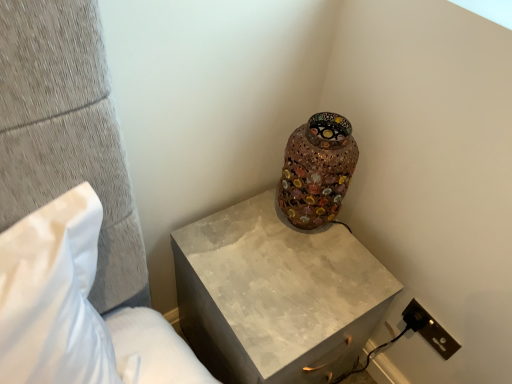
Question: Can you confirm if brown plastic electrical outlet at lower right is wider than mosaic glass vase at upper right?

Choices:
 (A) no
 (B) yes

Answer: (A)

Question: Is brown plastic electrical outlet at lower right looking in the opposite direction of mosaic glass vase at upper right?

Choices:
 (A) no
 (B) yes

Answer: (A)

Question: Could you tell me if brown plastic electrical outlet at lower right is facing mosaic glass vase at upper right?

Choices:
 (A) no
 (B) yes

Answer: (A)

Question: Is brown plastic electrical outlet at lower right closer to camera compared to mosaic glass vase at upper right?

Choices:
 (A) yes
 (B) no

Answer: (B)

Question: Considering the relative sizes of brown plastic electrical outlet at lower right and mosaic glass vase at upper right in the image provided, is brown plastic electrical outlet at lower right thinner than mosaic glass vase at upper right?

Choices:
 (A) no
 (B) yes

Answer: (B)

Question: Considering their positions, is brown plastic electrical outlet at lower right located in front of or behind matte concrete nightstand at upper right?

Choices:
 (A) behind
 (B) front

Answer: (A)

Question: Would you say brown plastic electrical outlet at lower right is inside or outside matte concrete nightstand at upper right?

Choices:
 (A) inside
 (B) outside

Answer: (B)

Question: In terms of width, does brown plastic electrical outlet at lower right look wider or thinner when compared to matte concrete nightstand at upper right?

Choices:
 (A) wide
 (B) thin

Answer: (B)

Question: Is point (413, 309) positioned closer to the camera than point (177, 246)?

Choices:
 (A) closer
 (B) farther

Answer: (B)

Question: From a real-world perspective, is mosaic glass vase at upper right above or below matte concrete nightstand at upper right?

Choices:
 (A) below
 (B) above

Answer: (B)

Question: Visually, is mosaic glass vase at upper right positioned to the left or to the right of matte concrete nightstand at upper right?

Choices:
 (A) left
 (B) right

Answer: (B)

Question: Considering the positions of mosaic glass vase at upper right and matte concrete nightstand at upper right in the image, is mosaic glass vase at upper right taller or shorter than matte concrete nightstand at upper right?

Choices:
 (A) short
 (B) tall

Answer: (A)

Question: Considering the positions of point (329, 188) and point (317, 288), is point (329, 188) closer or farther from the camera than point (317, 288)?

Choices:
 (A) farther
 (B) closer

Answer: (A)

Question: From the image's perspective, is white fabric pillow at left positioned above or below matte concrete nightstand at upper right?

Choices:
 (A) above
 (B) below

Answer: (A)

Question: Is white fabric pillow at left bigger or smaller than matte concrete nightstand at upper right?

Choices:
 (A) big
 (B) small

Answer: (B)